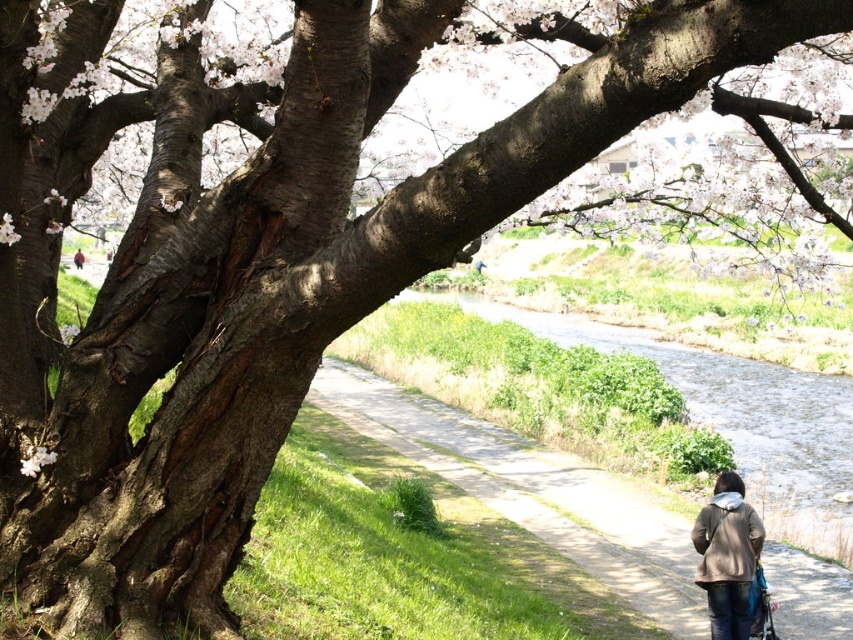
Consider the image. You are standing at the base of the cherry blossom tree and want to walk to the riverbank. Which direction should you head from the green grassy pavement at lower center to reach the river?

The green grassy pavement at lower center is located at point (534, 492), so you should head towards the lower part of the scene where the river is situated.

You are a hiker standing on the green grassy pavement at lower center and want to reach the brown textured jacket at lower right. Which direction should you move to get there?

The brown textured jacket at lower right is to the right of the green grassy pavement at lower center, so you should move to the right to reach it.